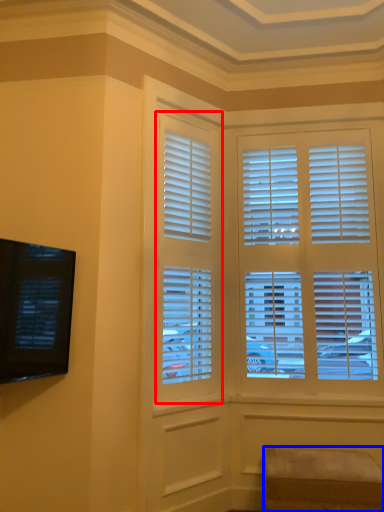
Question: Which object appears farthest to the camera in this image, window (highlighted by a red box) or furniture (highlighted by a blue box)?

Choices:
 (A) window
 (B) furniture

Answer: (A)